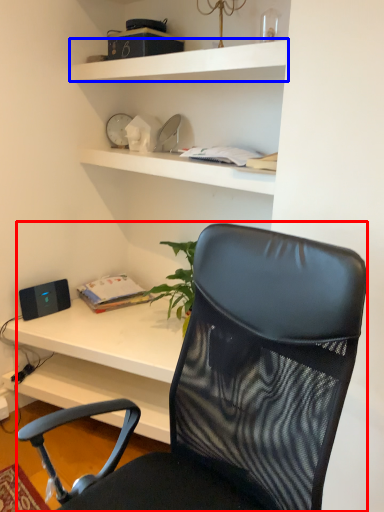
Question: Which object is closer to the camera taking this photo, chair (highlighted by a red box) or shelf (highlighted by a blue box)?

Choices:
 (A) chair
 (B) shelf

Answer: (A)